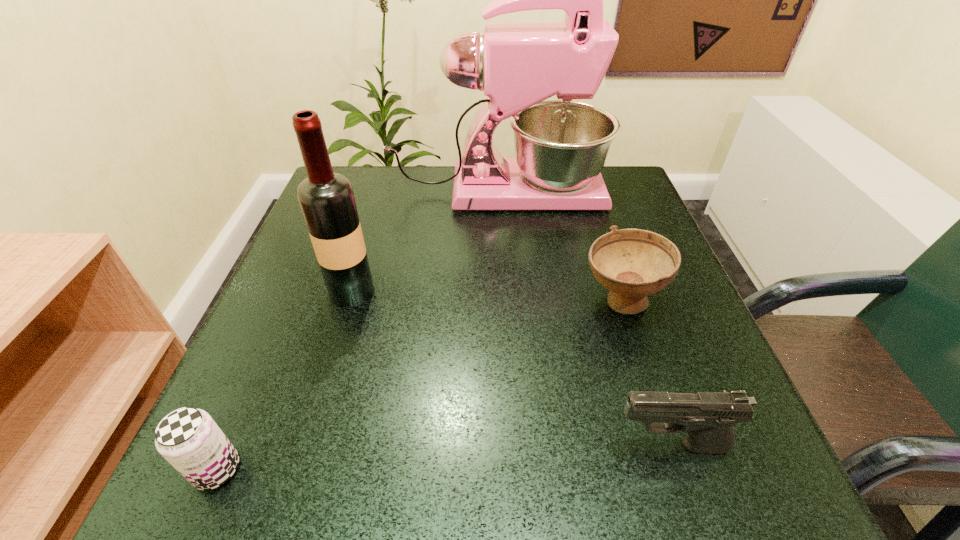
Identify the location of vacant area at the far right corner. (622, 202).

Locate an element on the screen. unoccupied area between the beer can and the wine bottle is located at coordinates (284, 380).

You are a GUI agent. You are given a task and a screenshot of the screen. Output one action in this format:
    pyautogui.click(x=<x>, y=<y>)
    Task: Click on the unoccupied position between the fourth shortest object and the tallest object
    The image size is (960, 540).
    Given the screenshot: What is the action you would take?
    pyautogui.click(x=424, y=242)

Image resolution: width=960 pixels, height=540 pixels. Identify the location of empty location between the fourth shortest object and the pistol. (512, 368).

The width and height of the screenshot is (960, 540). I want to click on unoccupied area between the soup bowl and the leftmost object, so click(x=419, y=386).

The height and width of the screenshot is (540, 960). What are the coordinates of `free spot between the farthest object and the pistol` in the screenshot? It's located at (584, 319).

This screenshot has width=960, height=540. What are the coordinates of `vacant area that lies between the leftmost object and the fourth shortest object` in the screenshot? It's located at (284, 380).

You are a GUI agent. You are given a task and a screenshot of the screen. Output one action in this format:
    pyautogui.click(x=<x>, y=<y>)
    Task: Click on the vacant space that is in between the wine bottle and the soup bowl
    
    Given the screenshot: What is the action you would take?
    pyautogui.click(x=486, y=296)

At what (x,y) coordinates should I click in order to perform the action: click on empty space between the leftmost object and the soup bowl. Please return your answer as a coordinate pair (x, y). The width and height of the screenshot is (960, 540). Looking at the image, I should click on (419, 386).

This screenshot has height=540, width=960. What are the coordinates of `free space between the soup bowl and the pistol` in the screenshot? It's located at (645, 374).